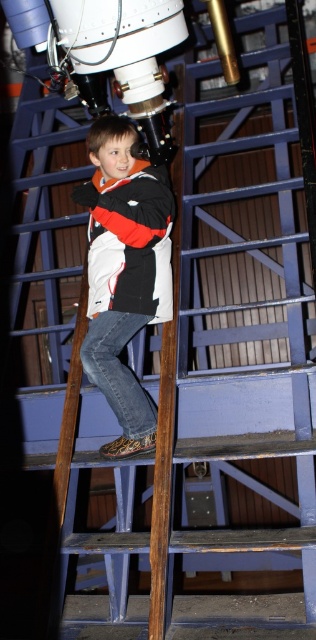
You are a tailor measuring jackets for a customer. You have two jackets in front of you, the denim jacket at center and the white matte jacket at center. The customer wants to know if there is enough space between them to place a 5 centimeter thick cushion. Can you confirm?

The denim jacket at center is 5.12 centimeters from white matte jacket at center. Since the distance between them is 5.12 cm, which is slightly more than the cushion thickness of 5 cm, there is enough space to place the cushion between the denim jacket at center and the white matte jacket at center.

You are a photographer trying to capture a clear image of both the denim jacket at center and the white matte jacket at center. Since the telescope is in the background, will you need to adjust your focus to ensure both jackets are in focus?

The denim jacket at center is closer to the viewer than the white matte jacket at center. To capture both in focus, adjust the focus to account for the distance between them.

You are a tailor measuring jackets for a customer. You see the denim jacket at center and the white matte jacket at center in the image. Which jacket should you recommend if the customer prefers a longer jacket?

The denim jacket at center has a greater height compared to the white matte jacket at center, so you should recommend the denim jacket at center.